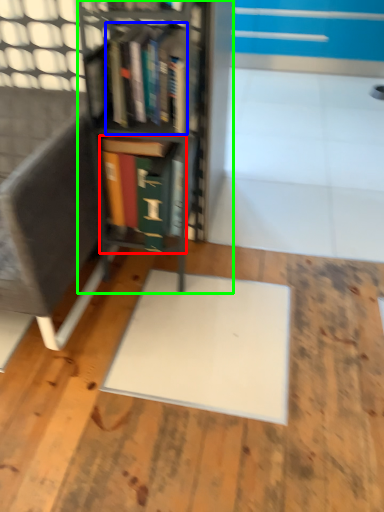
Question: Which object is the farthest from book (highlighted by a red box)? Choose among these: book (highlighted by a blue box) or bookcase (highlighted by a green box).

Choices:
 (A) book
 (B) bookcase

Answer: (A)